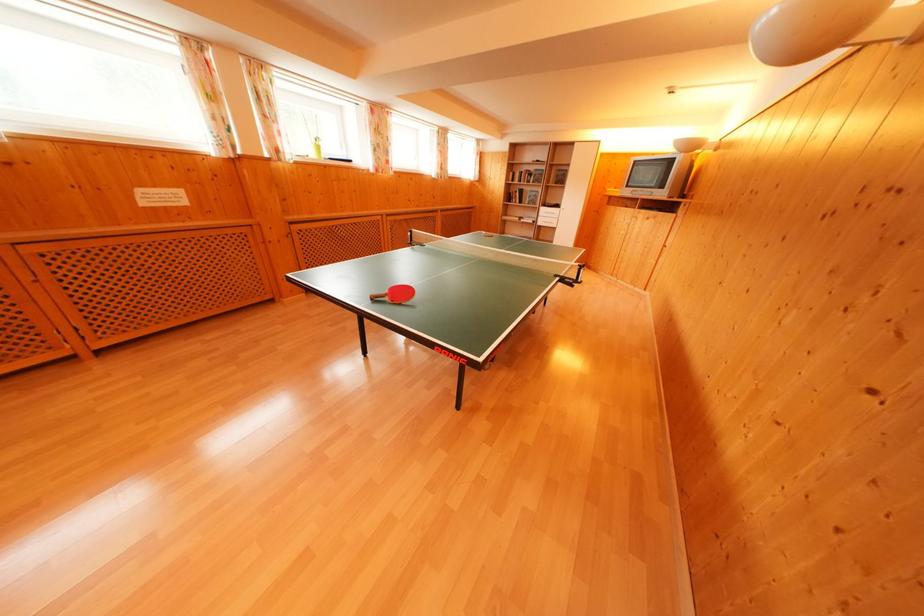
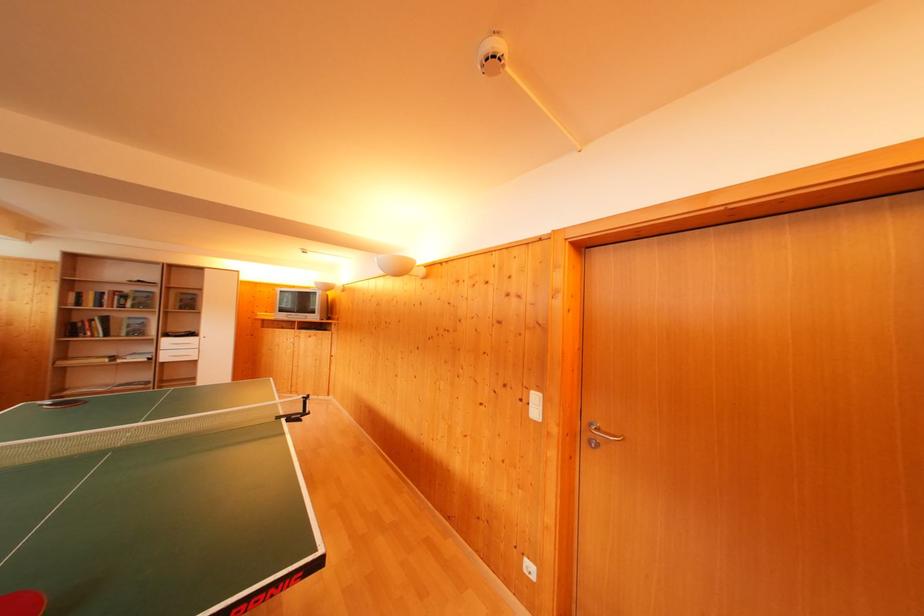
Locate, in the second image, the point that corresponds to (x=537, y=203) in the first image.

(140, 331)